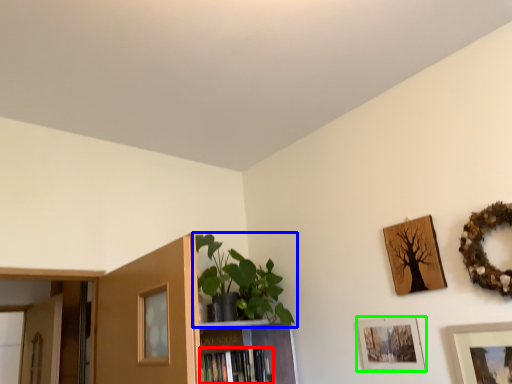
Question: Estimate the real-world distances between objects in this image. Which object is closer to book (highlighted by a red box), houseplant (highlighted by a blue box) or picture frame (highlighted by a green box)?

Choices:
 (A) houseplant
 (B) picture frame

Answer: (A)